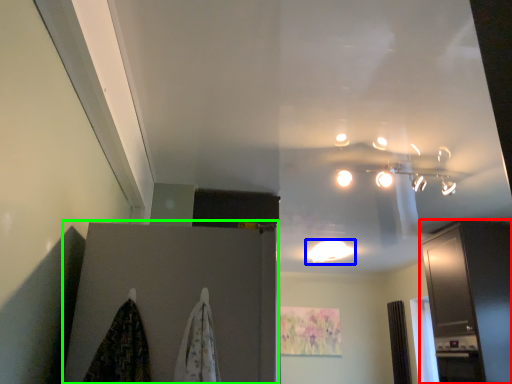
Question: Which object is the closest to the cabinetry (highlighted by a red box)? Choose among these: lighting (highlighted by a blue box) or door (highlighted by a green box).

Choices:
 (A) lighting
 (B) door

Answer: (A)